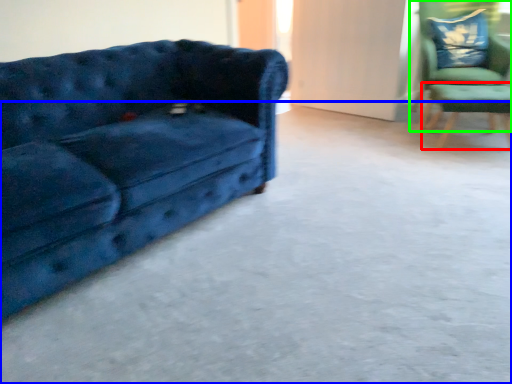
Question: Which is nearer to the side table (highlighted by a red box)? concrete (highlighted by a blue box) or chair (highlighted by a green box).

Choices:
 (A) concrete
 (B) chair

Answer: (B)